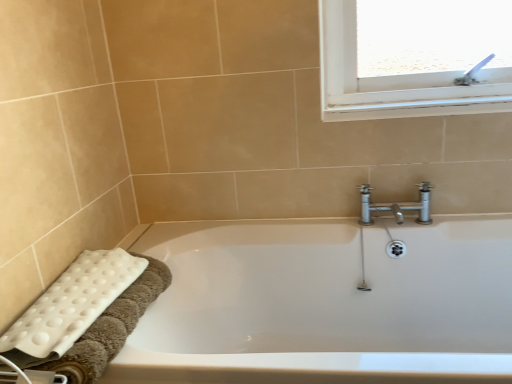
Locate an element on the screen. white glossy bathtub at lower left is located at coordinates (326, 303).

What is the approximate height of white plastic towel bar at lower left?

The height of white plastic towel bar at lower left is 7.82 centimeters.

Locate an element on the screen. The height and width of the screenshot is (384, 512). white glossy bathtub at lower left is located at coordinates (326, 303).

Consider the image. Considering the relative sizes of white textured bath towel at lower left and white glossy bathtub at lower left in the image provided, is white textured bath towel at lower left smaller than white glossy bathtub at lower left?

Correct, white textured bath towel at lower left occupies less space than white glossy bathtub at lower left.

Can you see white textured bath towel at lower left touching white glossy bathtub at lower left?

white textured bath towel at lower left and white glossy bathtub at lower left are clearly separated.

Identify the location of bath towel that appears behind the white glossy bathtub at lower left. The width and height of the screenshot is (512, 384). (70, 306).

From the image's perspective, which one is positioned lower, white plastic towel bar at lower left or white glossy bathtub at lower left?

white glossy bathtub at lower left is shown below in the image.

Does white plastic towel bar at lower left turn towards white glossy bathtub at lower left?

No, white plastic towel bar at lower left is not aimed at white glossy bathtub at lower left.

Is white plastic towel bar at lower left not within white glossy bathtub at lower left?

Yes, white plastic towel bar at lower left is not within white glossy bathtub at lower left.

Is white plastic towel bar at lower left smaller than white glossy bathtub at lower left?

Indeed, white plastic towel bar at lower left has a smaller size compared to white glossy bathtub at lower left.

From a real-world perspective, which is physically below, white plastic towel bar at lower left or white textured bath towel at lower left?

From a 3D spatial view, white plastic towel bar at lower left is below.

Which is nearer, (16, 378) or (90, 294)?

Clearly, point (16, 378) is closer to the camera than point (90, 294).

Considering the sizes of objects white plastic towel bar at lower left and white textured bath towel at lower left in the image provided, who is shorter, white plastic towel bar at lower left or white textured bath towel at lower left?

white textured bath towel at lower left is shorter.

Is white textured bath towel at lower left beside white plastic towel bar at lower left?

No, white textured bath towel at lower left is not with white plastic towel bar at lower left.

Can you confirm if white textured bath towel at lower left is smaller than white plastic towel bar at lower left?

Actually, white textured bath towel at lower left might be larger than white plastic towel bar at lower left.

In terms of height, does white textured bath towel at lower left look taller or shorter compared to white plastic towel bar at lower left?

In the image, white textured bath towel at lower left appears to be shorter than white plastic towel bar at lower left.

Could you tell me if white textured bath towel at lower left is facing white plastic towel bar at lower left?

No.

Which is in front, point (269, 336) or point (51, 380)?

Positioned in front is point (51, 380).

Looking at this image, is white glossy bathtub at lower left positioned before white plastic towel bar at lower left?

No, the depth of white glossy bathtub at lower left is greater than that of white plastic towel bar at lower left.

Which is more to the left, white glossy bathtub at lower left or white plastic towel bar at lower left?

From the viewer's perspective, white plastic towel bar at lower left appears more on the left side.

Looking at the image, does white glossy bathtub at lower left seem bigger or smaller compared to white plastic towel bar at lower left?

Considering their sizes, white glossy bathtub at lower left takes up more space than white plastic towel bar at lower left.

Which of these two, white glossy bathtub at lower left or white textured bath towel at lower left, is smaller?

white textured bath towel at lower left is smaller.

Which is nearer, (444, 253) or (13, 353)?

The point (13, 353) is closer to the camera.

Is white glossy bathtub at lower left positioned with its back to white textured bath towel at lower left?

No.

From a real-world perspective, is white glossy bathtub at lower left physically located above or below white textured bath towel at lower left?

From a real-world perspective, white glossy bathtub at lower left is physically below white textured bath towel at lower left.

The image size is (512, 384). Identify the location of bathtub located underneath the white textured bath towel at lower left (from a real-world perspective). (326, 303).

The height and width of the screenshot is (384, 512). I want to click on towel bar above the white glossy bathtub at lower left (from a real-world perspective), so click(45, 377).

When comparing their distances from white plastic towel bar at lower left, does white glossy bathtub at lower left or white textured bath towel at lower left seem closer?

Based on the image, white textured bath towel at lower left appears to be nearer to white plastic towel bar at lower left.

Looking at the image, which one is located further to white glossy bathtub at lower left, white plastic towel bar at lower left or white textured bath towel at lower left?

white plastic towel bar at lower left lies further to white glossy bathtub at lower left than the other object.

From the image, which object appears to be farther from white glossy bathtub at lower left, white textured bath towel at lower left or white plastic towel bar at lower left?

white plastic towel bar at lower left lies further to white glossy bathtub at lower left than the other object.

Looking at the image, which one is located closer to white textured bath towel at lower left, white glossy bathtub at lower left or white plastic towel bar at lower left?

white plastic towel bar at lower left lies closer to white textured bath towel at lower left than the other object.

When comparing their distances from white plastic towel bar at lower left, does white textured bath towel at lower left or white glossy bathtub at lower left seem closer?

Among the two, white textured bath towel at lower left is located nearer to white plastic towel bar at lower left.

Looking at the image, which one is located further to white textured bath towel at lower left, white plastic towel bar at lower left or white glossy bathtub at lower left?

Based on the image, white glossy bathtub at lower left appears to be further to white textured bath towel at lower left.

In order to click on towel bar between white textured bath towel at lower left and white glossy bathtub at lower left in this screenshot , I will do `click(45, 377)`.